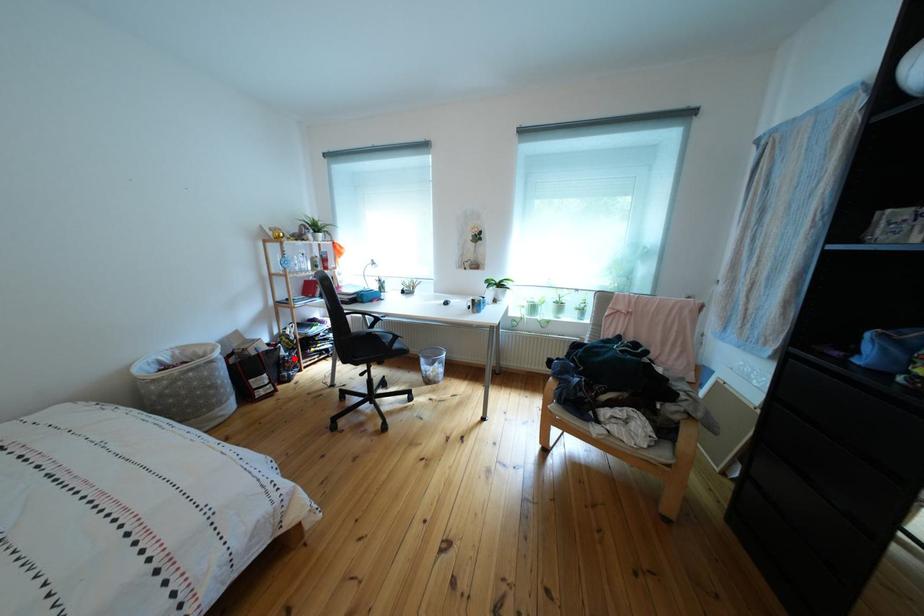
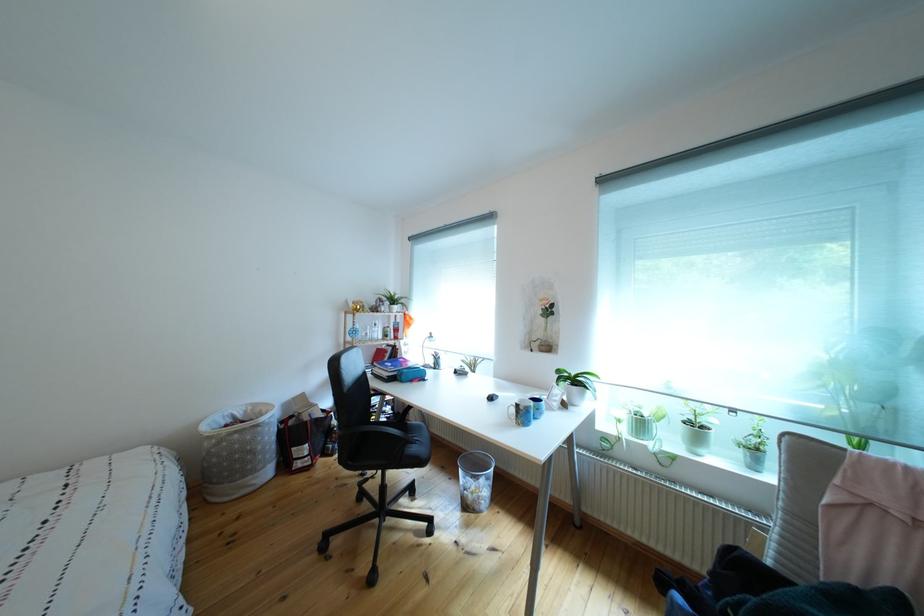
The point at the highlighted location is marked in the first image. Where is the corresponding point in the second image?

(346, 428)